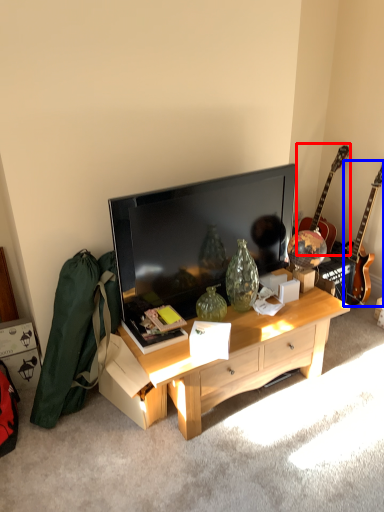
Question: Which point is closer to the camera, guitar (highlighted by a red box) or guitar (highlighted by a blue box)?

Choices:
 (A) guitar
 (B) guitar

Answer: (B)